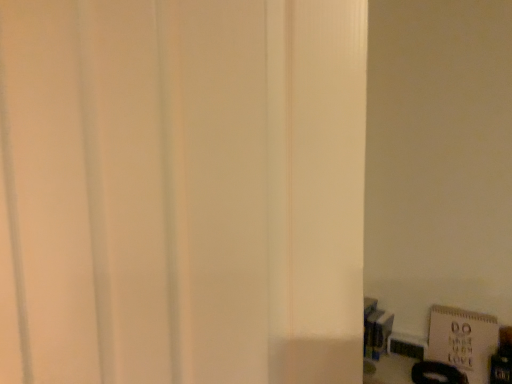
Locate an element on the screen. This screenshot has width=512, height=384. white matte door at center is located at coordinates (182, 190).

What do you see at coordinates (182, 190) in the screenshot?
I see `white matte door at center` at bounding box center [182, 190].

What is the approximate width of white matte door at center?

5.24 inches.

Find the location of a particular element. Image resolution: width=512 pixels, height=384 pixels. white matte bulletin board at lower right is located at coordinates (463, 340).

This screenshot has height=384, width=512. What do you see at coordinates (463, 340) in the screenshot?
I see `white matte bulletin board at lower right` at bounding box center [463, 340].

Locate an element on the screen. The width and height of the screenshot is (512, 384). white matte door at center is located at coordinates (182, 190).

Which is more to the right, white matte bulletin board at lower right or white matte door at center?

Positioned to the right is white matte bulletin board at lower right.

Is white matte bulletin board at lower right further to the viewer compared to white matte door at center?

Yes, it is.

Considering the positions of point (487, 382) and point (55, 234), is point (487, 382) closer or farther from the camera than point (55, 234)?

Point (487, 382) appears to be farther away from the viewer than point (55, 234).

From the image's perspective, does white matte bulletin board at lower right appear higher than white matte door at center?

No, from the image's perspective, white matte bulletin board at lower right is not above white matte door at center.

From a real-world perspective, is white matte bulletin board at lower right physically above white matte door at center?

No.

In the scene shown: Is white matte bulletin board at lower right wider or thinner than white matte door at center?

white matte bulletin board at lower right is thinner than white matte door at center.

Is white matte bulletin board at lower right shorter than white matte door at center?

Correct, white matte bulletin board at lower right is not as tall as white matte door at center.

Considering the relative sizes of white matte bulletin board at lower right and white matte door at center in the image provided, is white matte bulletin board at lower right smaller than white matte door at center?

Yes.

Is white matte bulletin board at lower right inside or outside of white matte door at center?

white matte bulletin board at lower right is outside white matte door at center.

Is there a large distance between white matte bulletin board at lower right and white matte door at center?

white matte bulletin board at lower right is positioned a significant distance from white matte door at center.

Is white matte bulletin board at lower right facing towards white matte door at center?

No, white matte bulletin board at lower right does not turn towards white matte door at center.

What's the angular difference between white matte bulletin board at lower right and white matte door at center's facing directions?

There is a 19.2-degree angle between the facing directions of white matte bulletin board at lower right and white matte door at center.

How distant is white matte bulletin board at lower right from white matte door at center?

3.49 feet.

Image resolution: width=512 pixels, height=384 pixels. Find the location of `bulletin board on the right of white matte door at center`. bulletin board on the right of white matte door at center is located at coordinates (463, 340).

Which object is positioned more to the left, white matte door at center or white matte bulletin board at lower right?

Positioned to the left is white matte door at center.

Considering their positions, is white matte door at center located in front of or behind white matte bulletin board at lower right?

white matte door at center is positioned closer to the viewer than white matte bulletin board at lower right.

Considering the points (181, 55) and (431, 342), which point is in front, point (181, 55) or point (431, 342)?

The point (181, 55) is closer to the camera.

From the image's perspective, is white matte door at center over white matte bulletin board at lower right?

Indeed, from the image's perspective, white matte door at center is shown above white matte bulletin board at lower right.

From a real-world perspective, which is physically above, white matte door at center or white matte bulletin board at lower right?

white matte door at center, from a real-world perspective.

Considering the relative sizes of white matte door at center and white matte bulletin board at lower right in the image provided, is white matte door at center wider than white matte bulletin board at lower right?

Indeed, white matte door at center has a greater width compared to white matte bulletin board at lower right.

Does white matte door at center have a lesser height compared to white matte bulletin board at lower right?

No, white matte door at center is not shorter than white matte bulletin board at lower right.

Who is smaller, white matte door at center or white matte bulletin board at lower right?

Smaller between the two is white matte bulletin board at lower right.

Is white matte bulletin board at lower right completely or partially inside white matte door at center?

No, white matte bulletin board at lower right is located outside of white matte door at center.

Does white matte door at center touch white matte bulletin board at lower right?

There is a gap between white matte door at center and white matte bulletin board at lower right.

Could you tell me if white matte door at center is facing white matte bulletin board at lower right?

No, white matte door at center is not aimed at white matte bulletin board at lower right.

How many degrees apart are the facing directions of white matte door at center and white matte bulletin board at lower right?

There is a 19.2-degree angle between the facing directions of white matte door at center and white matte bulletin board at lower right.

In order to click on door above the white matte bulletin board at lower right (from a real-world perspective) in this screenshot , I will do `click(182, 190)`.

Find the location of a particular element. The height and width of the screenshot is (384, 512). bulletin board below the white matte door at center (from the image's perspective) is located at coordinates (463, 340).

The image size is (512, 384). I want to click on bulletin board behind the white matte door at center, so click(463, 340).